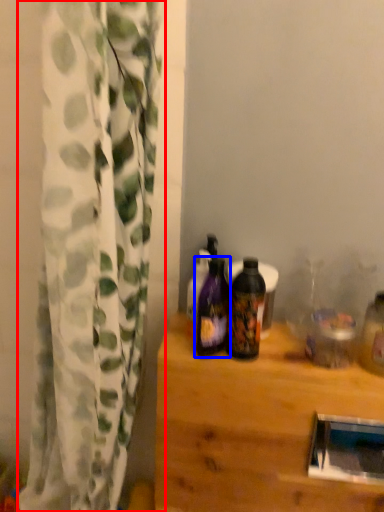
Question: Which of the following is the closest to the observer, curtain (highlighted by a red box) or bottle (highlighted by a blue box)?

Choices:
 (A) curtain
 (B) bottle

Answer: (A)